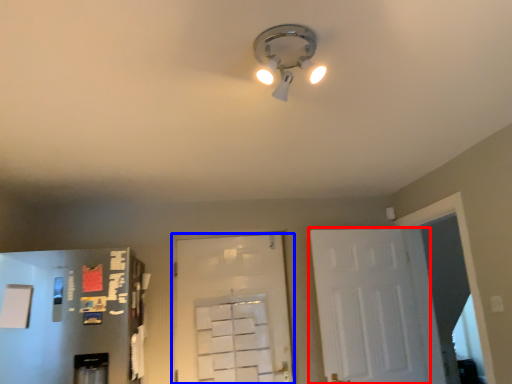
Question: Which point is closer to the camera, door (highlighted by a red box) or door (highlighted by a blue box)?

Choices:
 (A) door
 (B) door

Answer: (A)